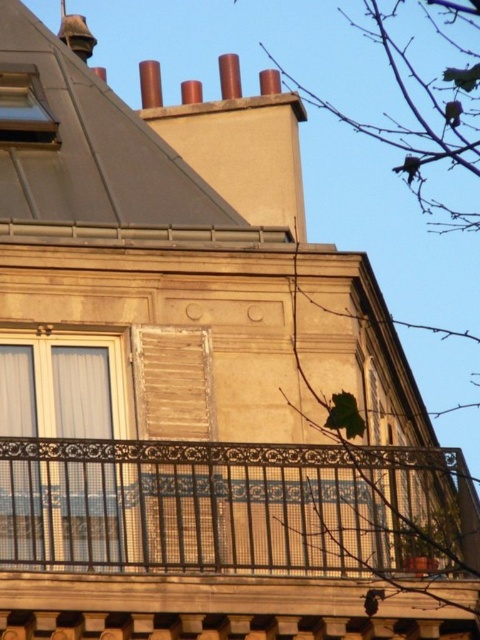
You are standing at a safe distance from a building with ornate balconies and red chimneys. There is a specific point marked at coordinates point (444, 454). If you want to reach that point without moving closer than 200 feet to the building, can you safely stay where you are?

The distance between point (444, 454) and the viewer is 215.14 feet. Since 215.14 feet is greater than 200 feet, you can safely stay where you are without moving closer than 200 feet to the building.

You are a window cleaner standing on the ground looking up at the building. You need to clean the matte glass window at upper left but there is a black wrought iron balcony at center in the way. Can you reach the window without climbing over the balcony?

The black wrought iron balcony at center is in front of the matte glass window at upper left, so you cannot directly access the window without moving around or over the balcony.